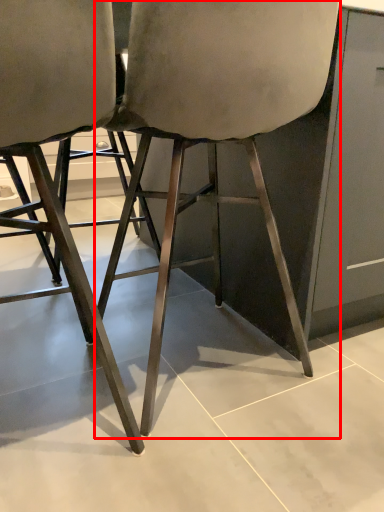
Question: From the image's perspective, what is the correct spatial positioning of chair (annotated by the red box) in reference to chair?

Choices:
 (A) below
 (B) above

Answer: (B)